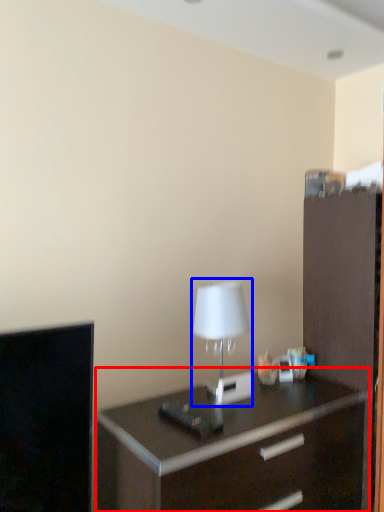
Question: Which object is further to the camera taking this photo, chest of drawers (highlighted by a red box) or table lamp (highlighted by a blue box)?

Choices:
 (A) chest of drawers
 (B) table lamp

Answer: (B)